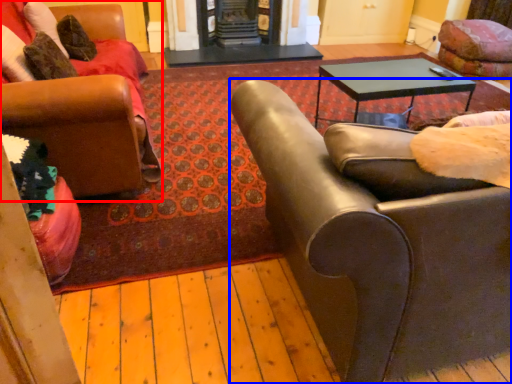
Question: Which object appears farthest to the camera in this image, chair (highlighted by a red box) or chair (highlighted by a blue box)?

Choices:
 (A) chair
 (B) chair

Answer: (A)